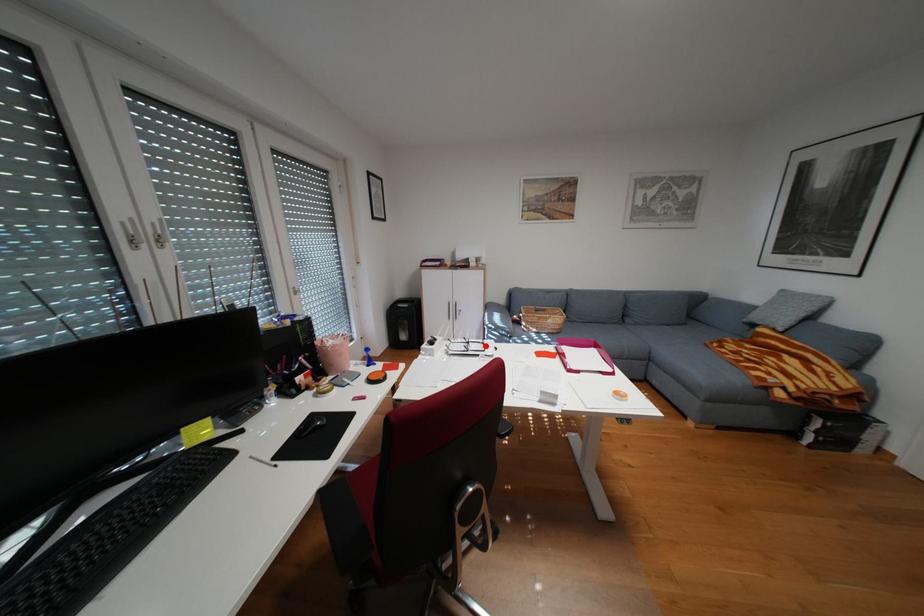
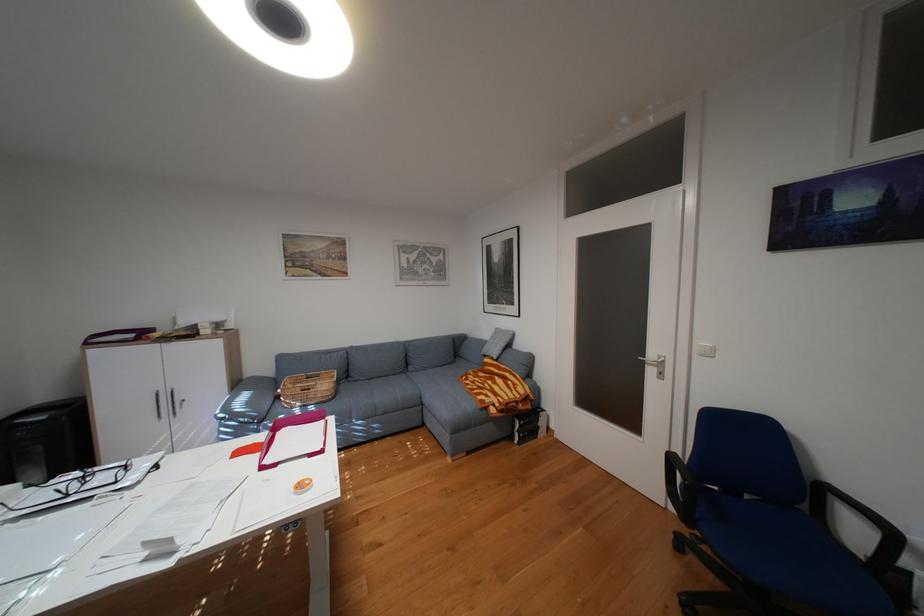
Question: I am providing you with two images of the same scene from different viewpoints. Given a red point in image1, look at the same physical point in image2. Is it:

Choices:
 (A) Closer to the viewpoint
 (B) Farther from the viewpoint

Answer: (B)